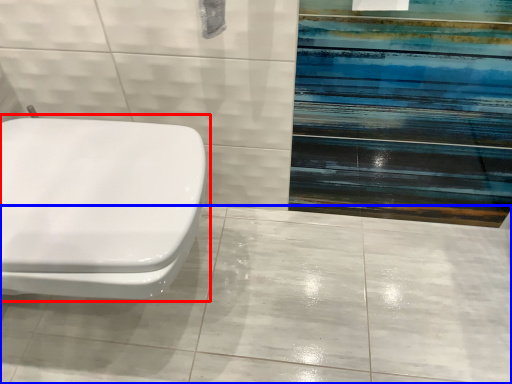
Question: Which point is further to the camera, toilet (highlighted by a red box) or ceramic tile (highlighted by a blue box)?

Choices:
 (A) toilet
 (B) ceramic tile

Answer: (B)